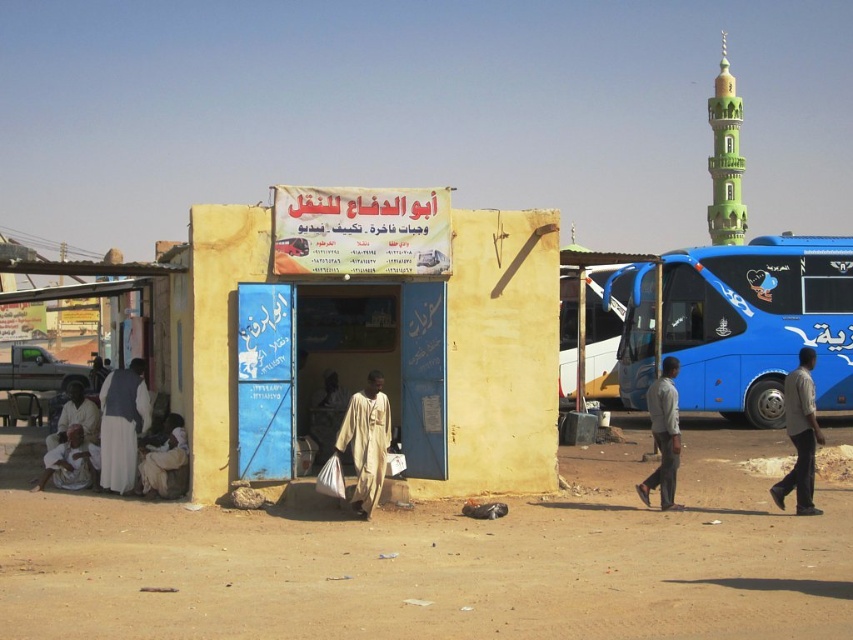
You are a traveler who wants to place your light brown fabric bag at lower left on a bench behind your light brown fabric shirt at right. Is this possible based on the scene?

The light brown fabric shirt at right is in front of the light brown fabric bag at lower left, so the bag is behind the shirt. Therefore, placing the bag on a bench behind the shirt would require moving the shirt first, as the bag is already positioned behind it.

Looking at this image, you are standing at the blue door of the building and want to walk to the point marked as point (793, 448). There is an obstacle at point (772, 403). Can you reach your destination without passing through the obstacle?

Point (772, 403) is behind point (793, 448). Therefore, you can reach the destination without passing through the obstacle as the obstacle is located behind the target point.